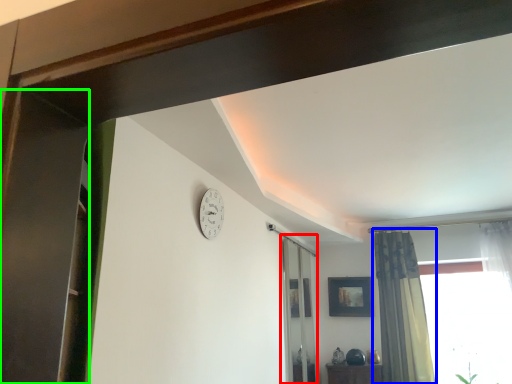
Question: Which object is the closest to the screen door (highlighted by a red box)? Choose among these: curtain (highlighted by a blue box) or screen door (highlighted by a green box).

Choices:
 (A) curtain
 (B) screen door

Answer: (A)